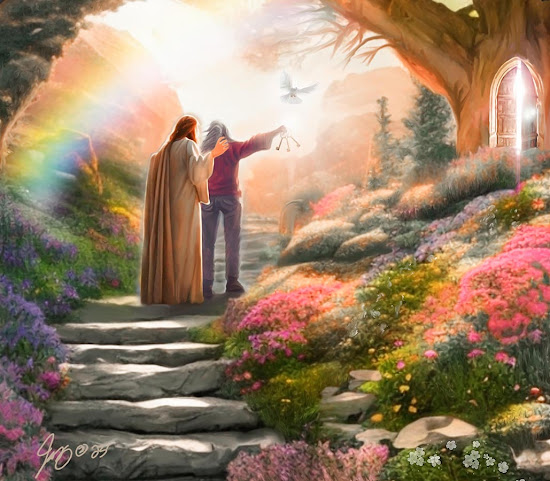
Identify the location of door. (528, 102), (504, 117).